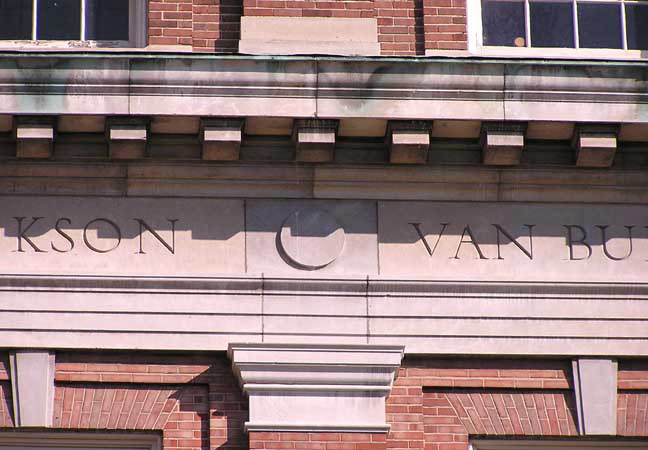
Find the location of a particular element. top of brown window frame is located at coordinates (96, 438).